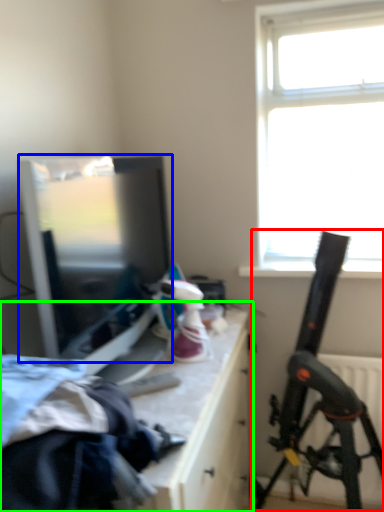
Question: Estimate the real-world distances between objects in this image. Which object is closer to weapon (highlighted by a red box), window screen (highlighted by a blue box) or table (highlighted by a green box)?

Choices:
 (A) window screen
 (B) table

Answer: (B)